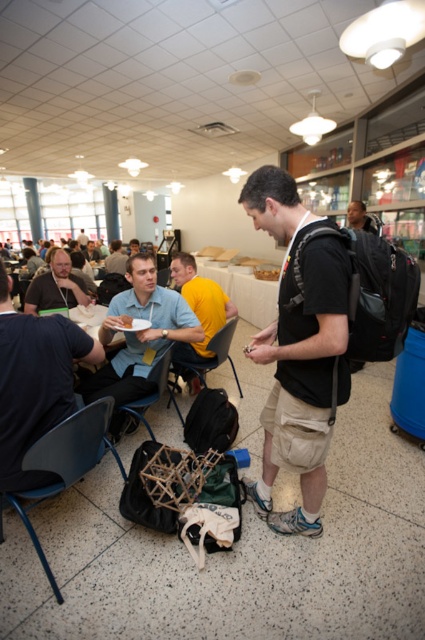
In the scene shown: You are a photographer trying to capture a candid shot of both the dark gray shirt at left and the matte blue shirt at center in the same frame. Considering their heights, which shirt would you need to adjust your camera angle to focus on more carefully to ensure both are in focus?

The dark gray shirt at left is not as tall as matte blue shirt at center, so you would need to adjust your camera angle to focus more carefully on the dark gray shirt at left to ensure both are in focus.

You are standing in the cafeteria and see the blue plastic chair at lower left and the matte black shirt at left. Which object is located to the right of the other?

The blue plastic chair at lower left is positioned on the right side of matte black shirt at left.

You are standing in the cafeteria and see a man in a black t shirt and beige shorts. There is a point at coordinates (34, 384). Where is this point located on the man?

The point at (34, 384) is located on the dark gray shirt at left.